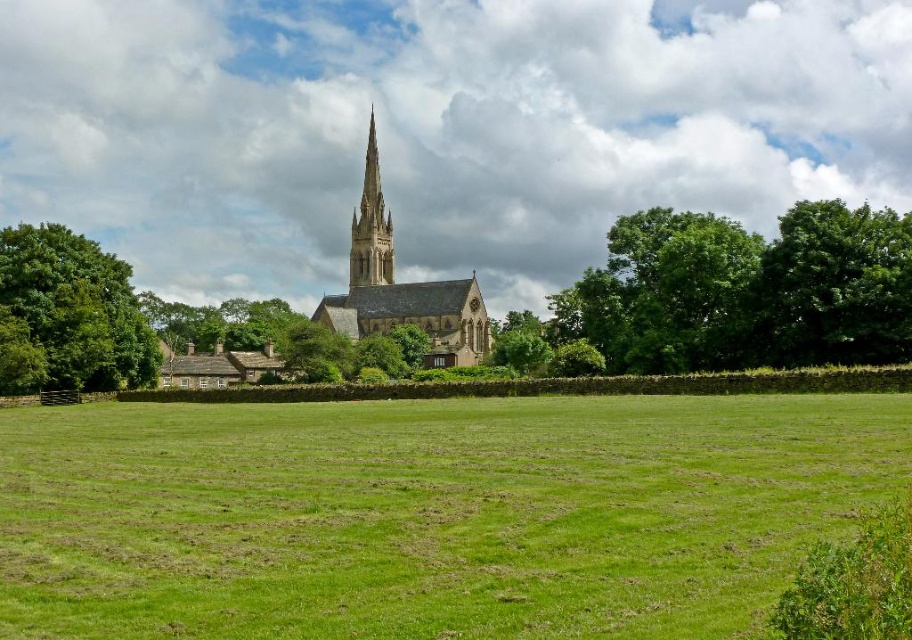
You are planning to install a bench between the green leafy tree at center and the green leafy tree at right. The bench is 2 meters long. Will there be enough space between the two trees to place the bench?

The distance between the green leafy tree at center and the green leafy tree at right is 6.30 meters. Since the bench is only 2 meters long, there is sufficient space to place it between them.

From the picture: You are standing at the base of the church spire and want to walk directly towards the green leafy tree at center. Which direction should you head?

The green leafy tree at center is located at coordinates point [744,291], so you should head towards the direction of the tree by moving towards the lower middle area from the church spire.

You are standing at the center of the image and want to walk towards the green leafy tree at left. In which direction should you head?

The green leafy tree at left is located at point (68, 316), which is to the left side of the image. Therefore, you should head towards the left direction to reach it.